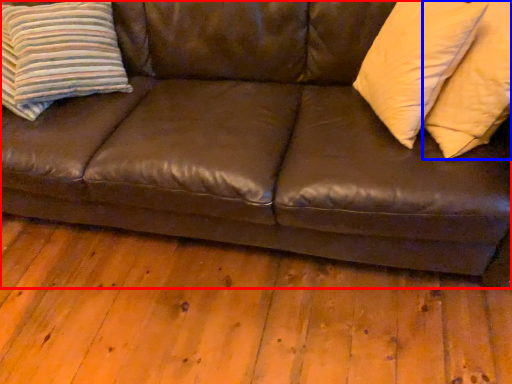
Question: Which object appears farthest to the camera in this image, studio couch (highlighted by a red box) or pillow (highlighted by a blue box)?

Choices:
 (A) studio couch
 (B) pillow

Answer: (B)